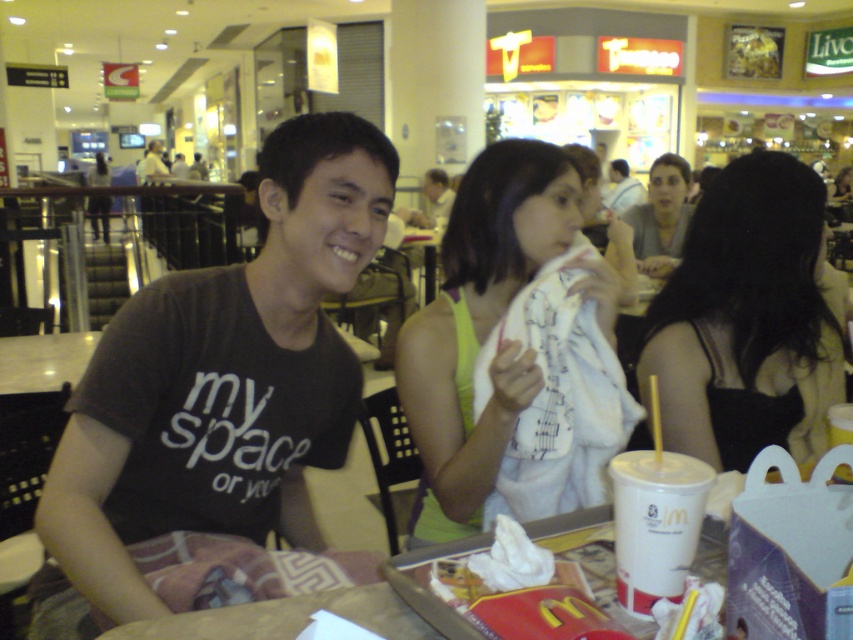
Question: From the image, what is the correct spatial relationship of matte white shirt at center in relation to matte black shirt at upper center?

Choices:
 (A) below
 (B) above

Answer: (A)

Question: Considering the real-world distances, which object is closest to the black fabric dress at center?

Choices:
 (A) matte black t-shirt at center
 (B) matte white shirt at center
 (C) matte black shirt at upper center
 (D) white fabric at center

Answer: (D)

Question: In this image, where is white fabric at center located relative to matte black shirt at upper center?

Choices:
 (A) below
 (B) above

Answer: (A)

Question: Which point is farther from the camera taking this photo?

Choices:
 (A) (469, 419)
 (B) (608, 170)
 (C) (662, 157)

Answer: (B)

Question: Can you confirm if white fabric at center is bigger than matte black shirt at upper center?

Choices:
 (A) no
 (B) yes

Answer: (A)

Question: Which point is closer to the camera taking this photo?

Choices:
 (A) (664, 273)
 (B) (619, 182)
 (C) (757, 372)
 (D) (260, 300)

Answer: (D)